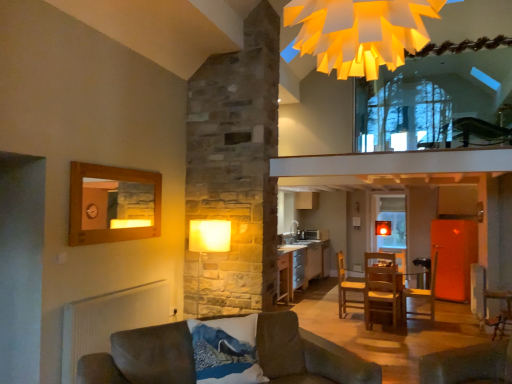
Question: Does point (96, 357) appear closer or farther from the camera than point (480, 266)?

Choices:
 (A) farther
 (B) closer

Answer: (B)

Question: From a real-world perspective, is velvet brown couch at lower left positioned above or below velvet brown armchair at lower right, which appears as the 1th armchair when viewed from the right?

Choices:
 (A) below
 (B) above

Answer: (A)

Question: Estimate the real-world distances between objects in this image. Which object is farther from the wooden chair at center, which is the 2th armchair from front to back?

Choices:
 (A) blue textured pillow at lower center
 (B) silver metallic cabinet at center
 (C) wooden table at center
 (D) transparent glass window at upper center
 (E) velvet brown armchair at lower right, arranged as the second armchair when viewed from the back

Answer: (A)

Question: Which object is positioned closest to the wooden chair at center, which ranks as the 1th armchair in left-to-right order?

Choices:
 (A) velvet brown couch at lower left
 (B) velvet brown armchair at lower right, arranged as the second armchair when viewed from the back
 (C) blue textured pillow at lower center
 (D) silver metallic cabinet at center
 (E) yellow paper chandelier at upper center

Answer: (B)